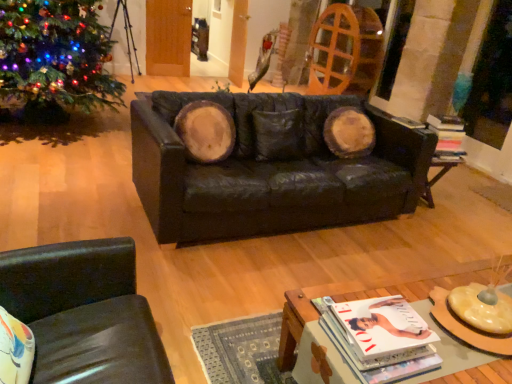
Question: Is black leather side table at lower right in front of or behind wooden coffee table at lower center in the image?

Choices:
 (A) behind
 (B) front

Answer: (A)

Question: Considering the positions of black leather side table at lower right and wooden coffee table at lower center in the image, is black leather side table at lower right bigger or smaller than wooden coffee table at lower center?

Choices:
 (A) big
 (B) small

Answer: (B)

Question: Which object is positioned closest to the black leather chair at lower left?

Choices:
 (A) matte white magazine at lower center, placed as the 2th magazine when sorted from top to bottom
 (B) green matte christmas tree at left
 (C) wooden coffee table at lower center
 (D) matte black magazine at right, the second magazine when ordered from bottom to top
 (E) black leather couch at center

Answer: (C)

Question: Which is nearer to the green matte christmas tree at left?

Choices:
 (A) matte black magazine at right, which appears as the first magazine when viewed from the right
 (B) matte white magazine at lower center, placed as the 1th magazine when sorted from left to right
 (C) black leather side table at lower right
 (D) wooden coffee table at lower center
 (E) black leather couch at center

Answer: (E)